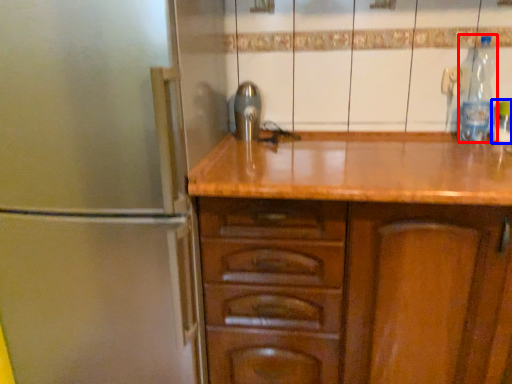
Question: Among these objects, which one is farthest to the camera, bottle (highlighted by a red box) or bottle (highlighted by a blue box)?

Choices:
 (A) bottle
 (B) bottle

Answer: (B)